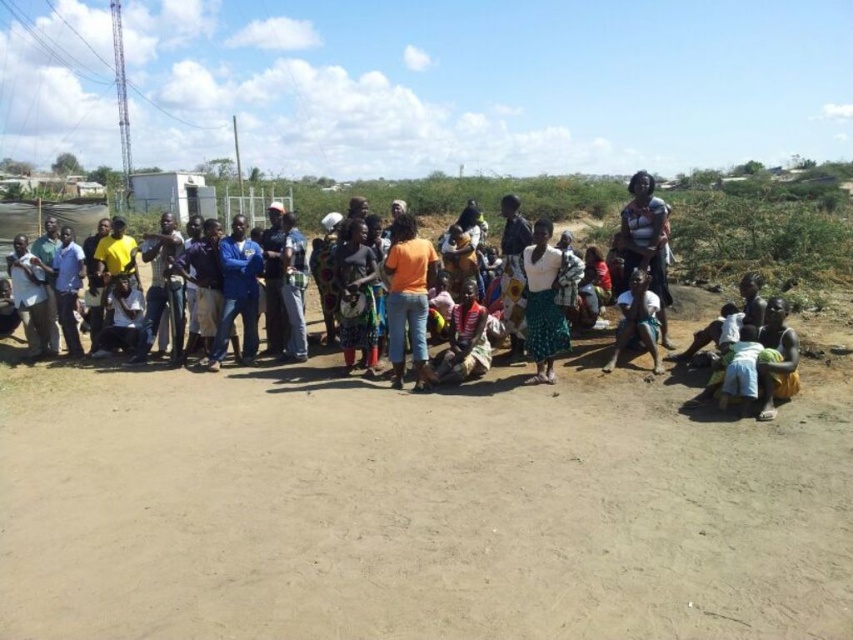
You are organizing a community event and need to arrange seating for attendees. The orange cotton shirt at center and the light brown fabric skirt at lower right are part of the setup. Based on their sizes, which one requires more space to accommodate?

The orange cotton shirt at center might require more space to accommodate since it might be wider than the light brown fabric skirt at lower right.

Consider the image. You are part of the group in the image and want to locate your friend who is wearing an orange matte shirt at center and another friend wearing a white fabric skirt at center. Based on their clothing, which friend is positioned more to the left?

The orange matte shirt at center is positioned to the left of white fabric skirt at center, so the friend wearing the orange matte shirt at center is more to the left.

You are standing in the rural area shown in the image. You want to walk towards the white fabric skirt at center. Which direction should you move relative to the brown sandy ground at center?

The brown sandy ground at center is closer to the viewer than the white fabric skirt at center, so to reach the white fabric skirt at center, you should move away from the brown sandy ground at center.